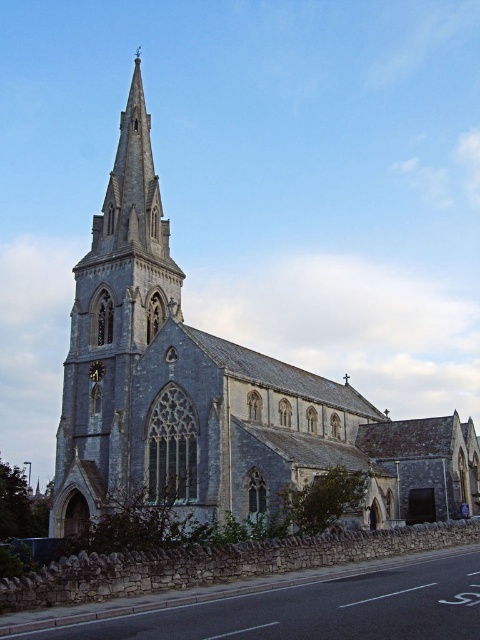
You are standing in front of the Gothic church and notice two points marked on the spire. The first point is at coordinates point (228, 372) and the second is at point (94, 374). Which of these points is closer to you?

Point (228, 372) is closer to the viewer than point (94, 374).

You are an architect visiting the church and want to compare the sizes of the gray stone church at center and the dark brown wooden clock at lower left. Which one is larger?

The gray stone church at center is bigger than the dark brown wooden clock at lower left according to the description.

You are standing in front of the gray stone church at center and want to see the top of the dark brown wooden clock at lower left. Which object would you need to look down at from the church?

The gray stone church at center is much taller than the dark brown wooden clock at lower left, so you would need to look down at the dark brown wooden clock at lower left from the church.